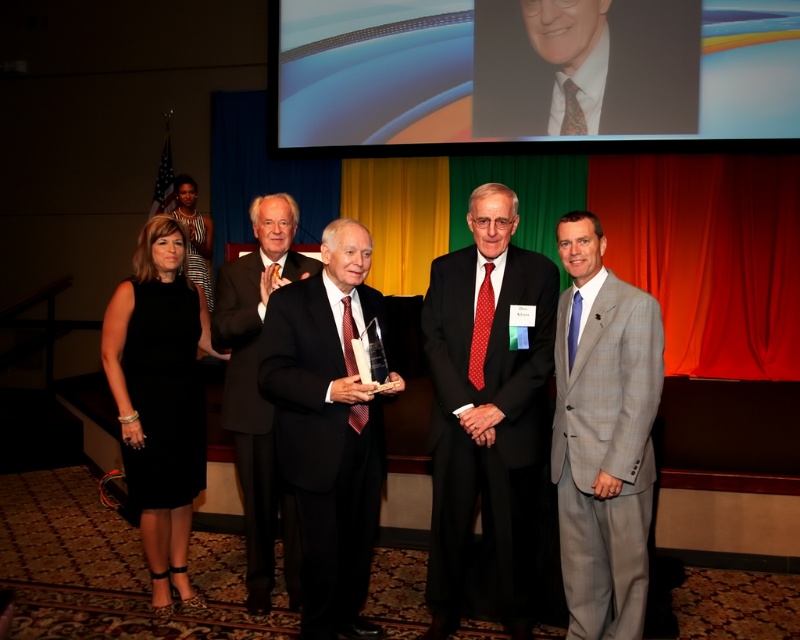
Is point (500, 604) closer to viewer compared to point (172, 257)?

Yes, it is.

Between black silk suit at center and black dress at lower left, which one appears on the left side from the viewer's perspective?

Positioned to the left is black dress at lower left.

Where is `black silk suit at center`? Image resolution: width=800 pixels, height=640 pixels. black silk suit at center is located at coordinates (486, 413).

Which of these two, black silk suit at center or black satin suit at center, stands shorter?

With less height is black satin suit at center.

Between black silk suit at center and black satin suit at center, which one has more height?

black silk suit at center is taller.

Measure the distance between black silk suit at center and camera.

They are 2.57 meters apart.

Where is `black silk suit at center`? This screenshot has width=800, height=640. black silk suit at center is located at coordinates (486, 413).

Can you confirm if gray checkered suit at right is positioned above black suit at center?

Incorrect, gray checkered suit at right is not positioned above black suit at center.

Is point (596, 378) farther from camera compared to point (292, 266)?

No, (596, 378) is closer to viewer.

Locate an element on the screen. This screenshot has width=800, height=640. gray checkered suit at right is located at coordinates (604, 435).

Locate an element on the screen. The height and width of the screenshot is (640, 800). gray checkered suit at right is located at coordinates (604, 435).